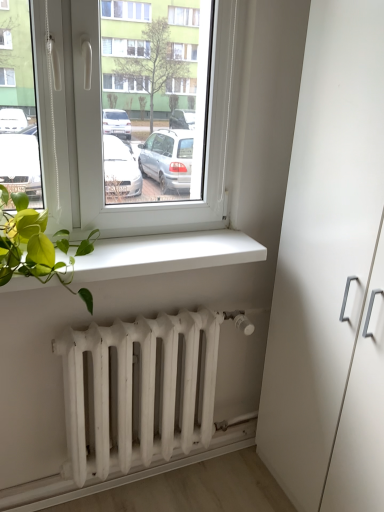
Identify the location of free point above white matte window sill at lower center (from a real-world perspective). (139, 250).